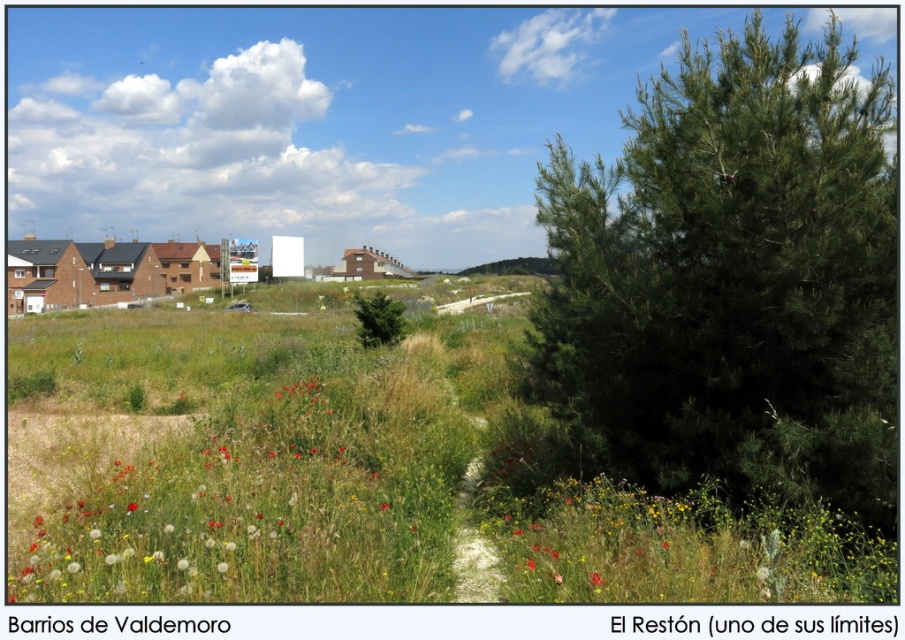
Question: Which of the following is the closest to the observer?

Choices:
 (A) (770, 356)
 (B) (592, 576)
 (C) (353, 294)

Answer: (B)

Question: Is green matte tree at center below red matte flower at center?

Choices:
 (A) yes
 (B) no

Answer: (B)

Question: Which object appears farthest from the camera in this image?

Choices:
 (A) green needle-like at right
 (B) green matte tree at center
 (C) red matte flower at center

Answer: (B)

Question: Is green needle-like at right to the left of green matte tree at center from the viewer's perspective?

Choices:
 (A) yes
 (B) no

Answer: (B)

Question: Which object is closer to the camera taking this photo?

Choices:
 (A) green matte tree at center
 (B) red matte flower at center

Answer: (B)

Question: Is green needle-like at right thinner than red matte flower at center?

Choices:
 (A) yes
 (B) no

Answer: (B)